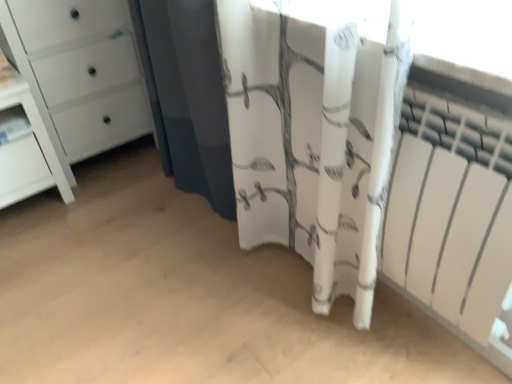
Where is `free space in front of white glossy chest of drawers at left`? The image size is (512, 384). free space in front of white glossy chest of drawers at left is located at coordinates (94, 211).